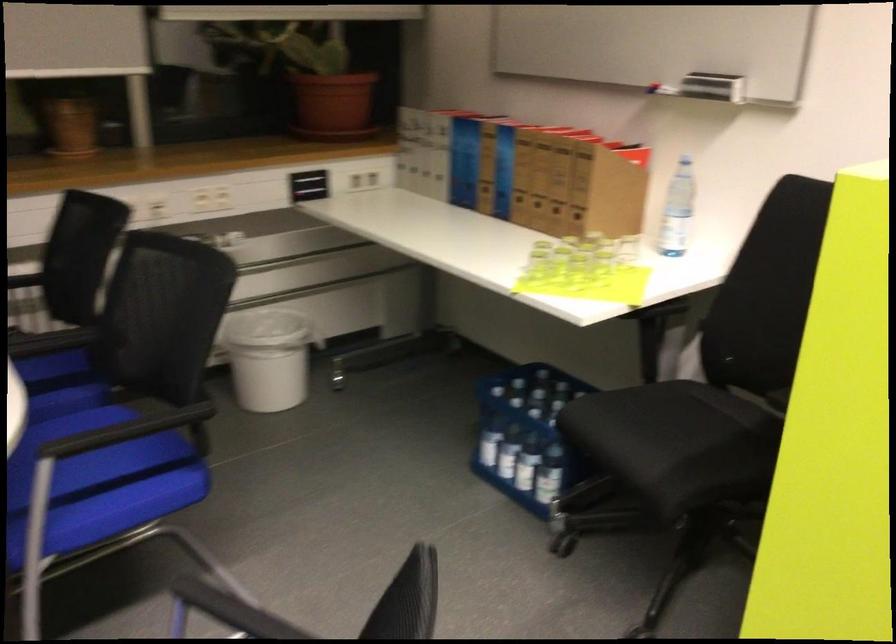
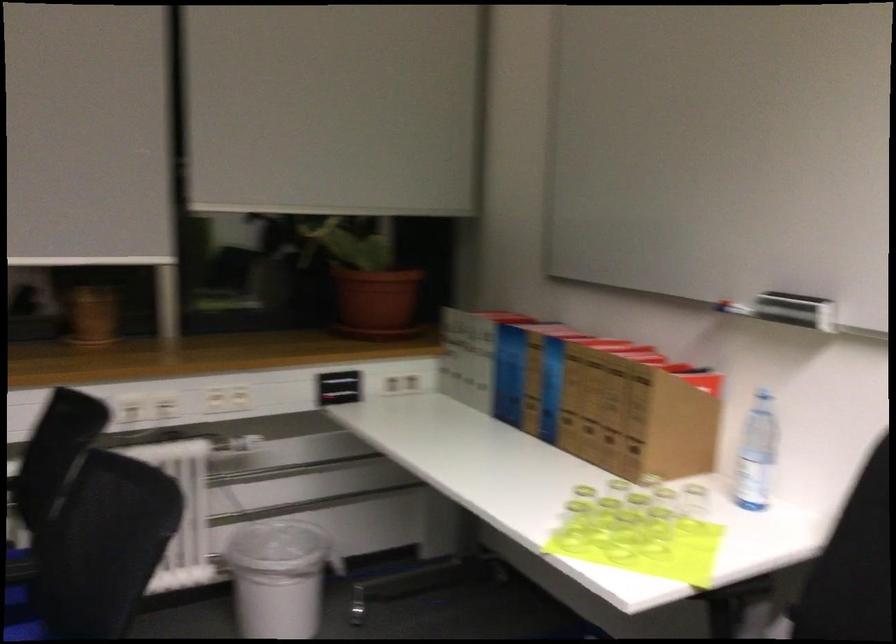
Question: The images are taken continuously from a first-person perspective. In which direction is your viewpoint rotating?

Choices:
 (A) Left
 (B) Right
 (C) Up
 (D) Down

Answer: (C)